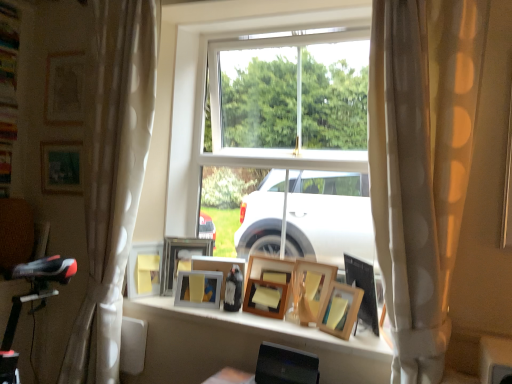
Question: Is wooden picture frame at center, acting as the ninth picture frame starting from the left, outside of wooden picture frame at center, the 6th picture frame positioned from the right?

Choices:
 (A) yes
 (B) no

Answer: (A)

Question: Does wooden picture frame at center, positioned as the 2th picture frame in right-to-left order, contain wooden picture frame at center, the 6th picture frame positioned from the right?

Choices:
 (A) no
 (B) yes

Answer: (A)

Question: Considering the relative sizes of wooden picture frame at center, positioned as the 2th picture frame in right-to-left order, and wooden picture frame at center, the fifth picture frame viewed from the left, in the image provided, is wooden picture frame at center, positioned as the 2th picture frame in right-to-left order, taller than wooden picture frame at center, the fifth picture frame viewed from the left,?

Choices:
 (A) no
 (B) yes

Answer: (B)

Question: Considering the relative sizes of wooden picture frame at center, positioned as the 2th picture frame in right-to-left order, and wooden picture frame at center, the fifth picture frame viewed from the left, in the image provided, is wooden picture frame at center, positioned as the 2th picture frame in right-to-left order, bigger than wooden picture frame at center, the fifth picture frame viewed from the left,?

Choices:
 (A) no
 (B) yes

Answer: (B)

Question: Considering the relative positions of wooden picture frame at center, positioned as the 2th picture frame in right-to-left order, and wooden picture frame at center, the 6th picture frame positioned from the right, in the image provided, is wooden picture frame at center, positioned as the 2th picture frame in right-to-left order, to the right of wooden picture frame at center, the 6th picture frame positioned from the right, from the viewer's perspective?

Choices:
 (A) yes
 (B) no

Answer: (A)

Question: From a real-world perspective, is wooden picture frame at center, acting as the ninth picture frame starting from the left, positioned under wooden picture frame at center, the 6th picture frame positioned from the right, based on gravity?

Choices:
 (A) no
 (B) yes

Answer: (A)

Question: Is matte wooden picture frame at upper left, marked as the 10th picture frame in a right-to-left arrangement, not within wooden picture frame at center, positioned as the 4th picture frame in right-to-left order?

Choices:
 (A) yes
 (B) no

Answer: (A)

Question: Is wooden picture frame at center, positioned as the 4th picture frame in right-to-left order, a part of matte wooden picture frame at upper left, marked as the 10th picture frame in a right-to-left arrangement?

Choices:
 (A) yes
 (B) no

Answer: (B)

Question: Is matte wooden picture frame at upper left, the 1th picture frame positioned from the left, far away from wooden picture frame at center, acting as the 7th picture frame starting from the left?

Choices:
 (A) no
 (B) yes

Answer: (B)

Question: From the image's perspective, would you say matte wooden picture frame at upper left, the 1th picture frame positioned from the left, is shown under wooden picture frame at center, positioned as the 4th picture frame in right-to-left order?

Choices:
 (A) yes
 (B) no

Answer: (B)

Question: From a real-world perspective, is matte wooden picture frame at upper left, marked as the 10th picture frame in a right-to-left arrangement, physically above wooden picture frame at center, positioned as the 4th picture frame in right-to-left order?

Choices:
 (A) no
 (B) yes

Answer: (B)

Question: From the image's perspective, does matte wooden picture frame at upper left, the 1th picture frame positioned from the left, appear higher than wooden picture frame at center, acting as the 7th picture frame starting from the left?

Choices:
 (A) no
 (B) yes

Answer: (B)

Question: Is wooden picture frame at center, positioned as the 4th picture frame in right-to-left order, at the right side of wooden picture frame at center, acting as the ninth picture frame starting from the left?

Choices:
 (A) yes
 (B) no

Answer: (B)